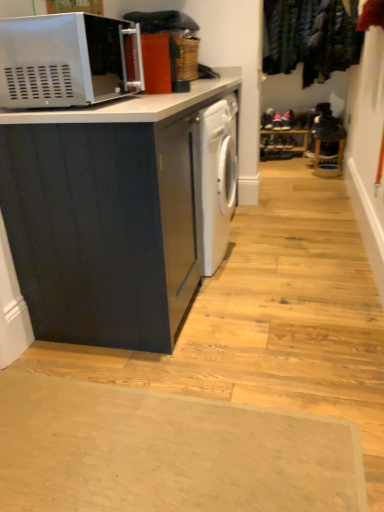
You are a GUI agent. You are given a task and a screenshot of the screen. Output one action in this format:
    pyautogui.click(x=<x>, y=<y>)
    Task: Click on the vacant area on top of beige rubber doormat at lower center (from a real-world perspective)
    The width and height of the screenshot is (384, 512).
    Given the screenshot: What is the action you would take?
    pyautogui.click(x=138, y=440)